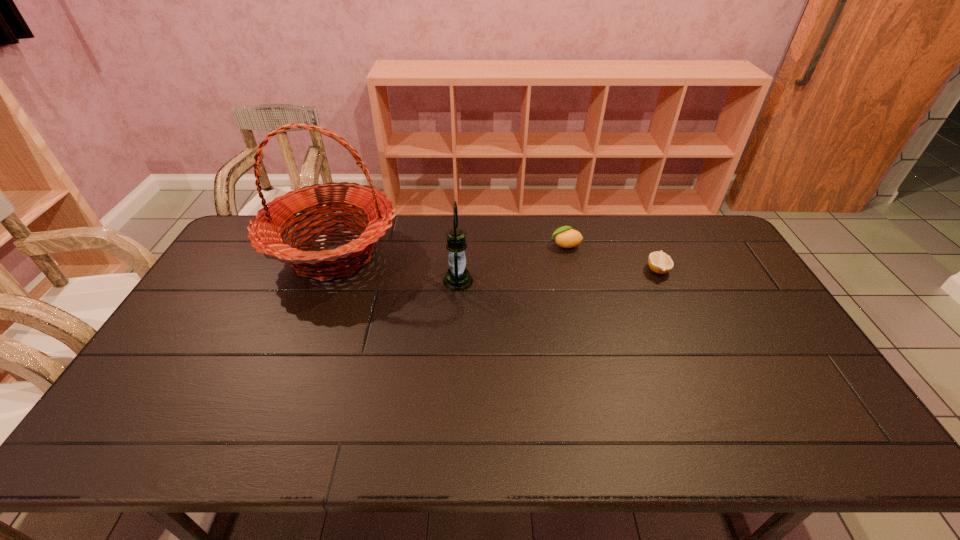
At what (x,y) coordinates should I click in order to perform the action: click on blank space at the left edge. Please return your answer as a coordinate pair (x, y). Looking at the image, I should click on (214, 338).

In the image, there is a desktop. Identify the location of vacant region at the right edge. Image resolution: width=960 pixels, height=540 pixels. (776, 364).

At what (x,y) coordinates should I click in order to perform the action: click on free space at the far right corner. Please return your answer as a coordinate pair (x, y). The width and height of the screenshot is (960, 540). Looking at the image, I should click on (693, 217).

At what (x,y) coordinates should I click in order to perform the action: click on vacant area between the tallest object and the lantern. Please return your answer as a coordinate pair (x, y). This screenshot has width=960, height=540. Looking at the image, I should click on (396, 267).

The width and height of the screenshot is (960, 540). I want to click on free area in between the nearer lemon and the basket, so click(495, 262).

The height and width of the screenshot is (540, 960). I want to click on free point between the left lemon and the nearer lemon, so click(612, 258).

Find the location of a particular element. The height and width of the screenshot is (540, 960). free point between the shorter lemon and the basket is located at coordinates (495, 262).

You are a GUI agent. You are given a task and a screenshot of the screen. Output one action in this format:
    pyautogui.click(x=<x>, y=<y>)
    Task: Click on the free space between the lantern and the second object from right to left
    The width and height of the screenshot is (960, 540).
    Given the screenshot: What is the action you would take?
    pyautogui.click(x=512, y=263)

The image size is (960, 540). Find the location of `free spot between the shorter lemon and the leftmost object`. free spot between the shorter lemon and the leftmost object is located at coordinates (495, 262).

Find the location of a particular element. This screenshot has width=960, height=540. the third closest object to the left lemon is located at coordinates (265, 233).